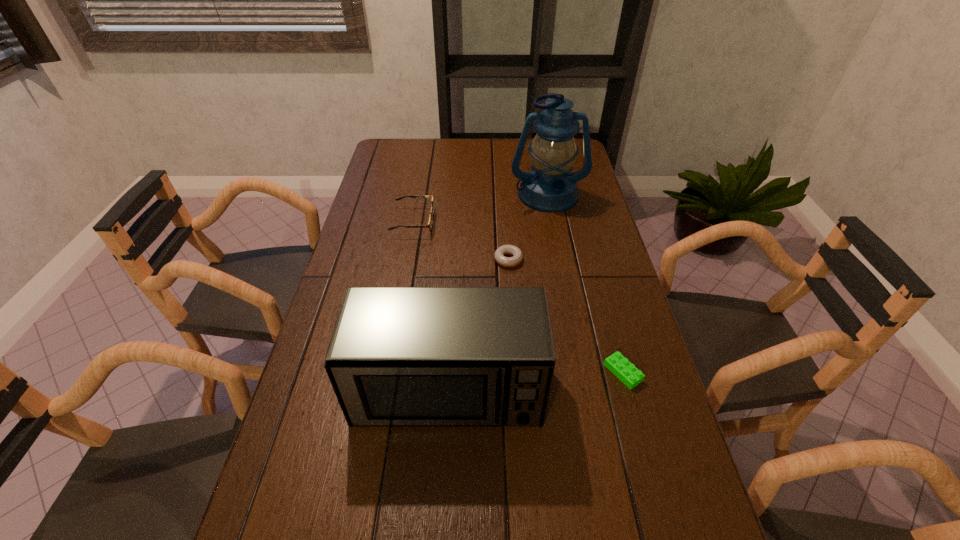
At what (x,y) coordinates should I click in order to perform the action: click on free spot between the tallest object and the spectacles. Please return your answer as a coordinate pair (x, y). This screenshot has width=960, height=540. Looking at the image, I should click on (481, 208).

The image size is (960, 540). What are the coordinates of `free space between the lantern and the third farthest object` in the screenshot? It's located at (528, 227).

Point out which object is positioned as the second nearest to the tallest object. Please provide its 2D coordinates. Your answer should be formatted as a tuple, i.e. [(x, y)], where the tuple contains the x and y coordinates of a point satisfying the conditions above.

[(430, 224)]

Identify which object is located as the second nearest to the lantern. Please provide its 2D coordinates. Your answer should be formatted as a tuple, i.e. [(x, y)], where the tuple contains the x and y coordinates of a point satisfying the conditions above.

[(430, 224)]

Where is `free region that satisfies the following two spatial constraints: 1. on the face of the tallest object; 2. on the frame of the third tallest object`? The width and height of the screenshot is (960, 540). free region that satisfies the following two spatial constraints: 1. on the face of the tallest object; 2. on the frame of the third tallest object is located at coordinates click(553, 221).

Identify the location of vacant area that satisfies the following two spatial constraints: 1. on the face of the lantern; 2. on the frame of the spectacles. This screenshot has width=960, height=540. (553, 221).